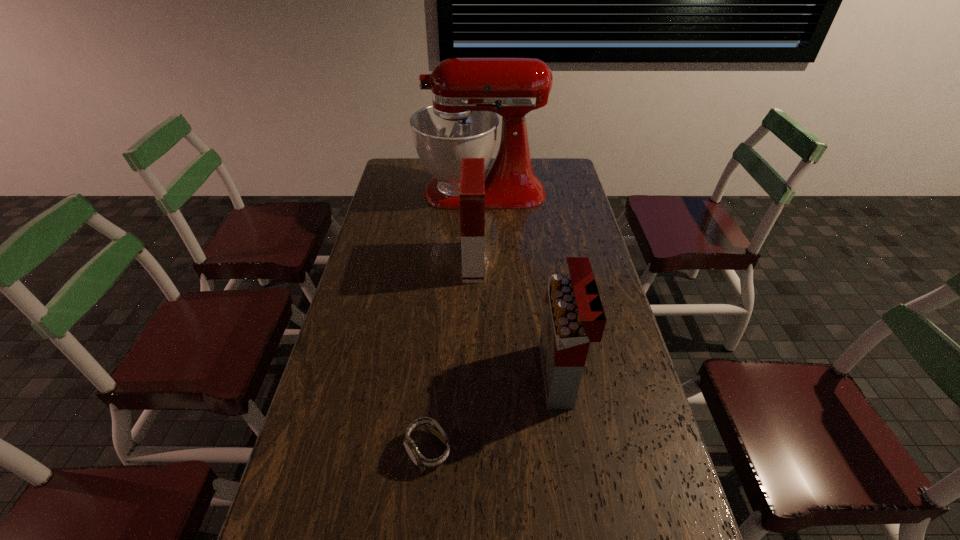
You are a GUI agent. You are given a task and a screenshot of the screen. Output one action in this format:
    pyautogui.click(x=<x>, y=<y>)
    Task: Click on the farthest object
    
    Given the screenshot: What is the action you would take?
    pyautogui.click(x=467, y=93)

At what (x,y) coordinates should I click in order to perform the action: click on the tallest object. Please return your answer as a coordinate pair (x, y). This screenshot has width=960, height=540. Looking at the image, I should click on (467, 93).

What are the coordinates of `the farther cigarette case` in the screenshot? It's located at (472, 181).

This screenshot has height=540, width=960. I want to click on the left cigarette case, so click(472, 181).

This screenshot has width=960, height=540. Identify the location of the second nearest object. (573, 316).

Where is `the right cigarette case`? This screenshot has height=540, width=960. the right cigarette case is located at coordinates (573, 316).

You are a GUI agent. You are given a task and a screenshot of the screen. Output one action in this format:
    pyautogui.click(x=<x>, y=<y>)
    Task: Click on the watch
    The height and width of the screenshot is (540, 960).
    Given the screenshot: What is the action you would take?
    pyautogui.click(x=433, y=427)

Where is `the shortest object`? The image size is (960, 540). the shortest object is located at coordinates (433, 427).

This screenshot has width=960, height=540. What are the coordinates of `vacant space located 0.130m at the attachment hub of the tallest object` in the screenshot? It's located at (388, 192).

Where is `vacant point located at the attachment hub of the tallest object`? vacant point located at the attachment hub of the tallest object is located at coordinates (396, 192).